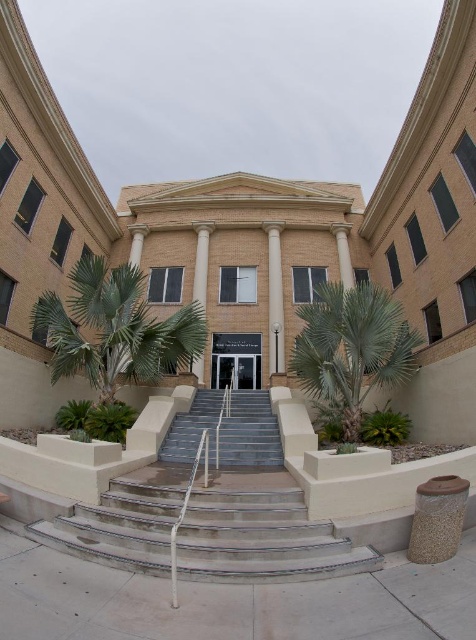
You are a visitor approaching the courthouse and need to reach the entrance. You see the gray concrete stairs at center and the white marble pillar at center. Which one is closer to the ground level?

The gray concrete stairs at center is located below the white marble pillar at center, so the gray concrete stairs at center is closer to the ground level.

You are a maintenance worker needing to place a 2 meter wide equipment on the metallic silver stairs at center or the white marble pillar at center. Based on the scene, which location can accommodate the equipment?

The metallic silver stairs at center has a width less than the white marble pillar at center, so the equipment can be placed on the white marble pillar at center since it is wider than the metallic silver stairs at center.

The image shows a building with two sets of stairs. The lower set has white railings and is wider. The upper set is narrower. A green leafy palm tree is located at point (115, 328). Which set of stairs is closer to the green leafy palm tree at left?

The lower set of stairs is closer to the green leafy palm tree at left because it is positioned further down the building compared to the upper set of stairs.